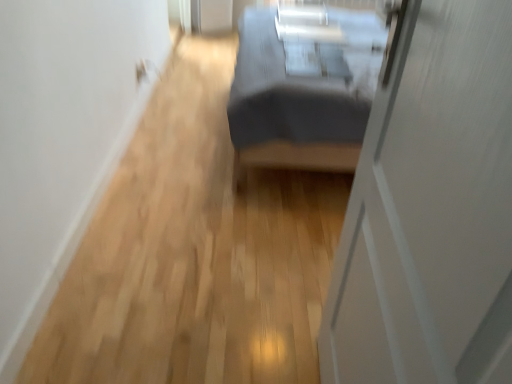
What do you see at coordinates (430, 209) in the screenshot?
I see `white matte door at right` at bounding box center [430, 209].

The width and height of the screenshot is (512, 384). What are the coordinates of `white matte door at right` in the screenshot? It's located at (430, 209).

What is the approximate height of white matte door at right?

white matte door at right is 3.96 feet in height.

This screenshot has height=384, width=512. In order to click on white matte door at right in this screenshot , I will do pos(430,209).